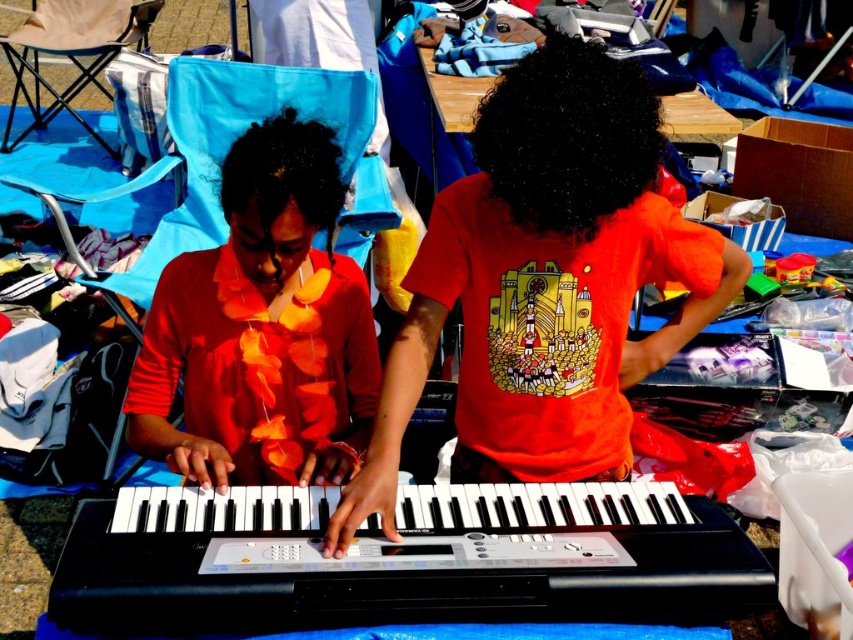
You are a photographer at an outdoor event. You need to position a light to the right of both the matte orange dress at center and the black curly hair at center. Is this possible given their current positions?

The matte orange dress at center is to the left of black curly hair at center, so placing the light to the right of both is possible as long as it is positioned to the right side of the black curly hair at center.

You are a photographer trying to capture a clear shot of the matte orange dress at center and the black curly hair at center. If you want to ensure both are fully visible in the frame without any part being cut off, which object should you focus on first considering their widths?

The matte orange dress at center might be wider than black curly hair at center, so you should focus on framing the matte orange dress at center first to ensure it fits entirely within the shot before adjusting for the black curly hair at center.

You are standing at the origin point of the coordinate system where the lower left corner of the image is the origin. The keyboard is at point (404, 560). If you want to walk directly to the keyboard, which direction should you move from your current position?

To reach the keyboard located at point (404, 560) from the origin, you should move northeast since the coordinates indicate a position to the right and above the starting point.